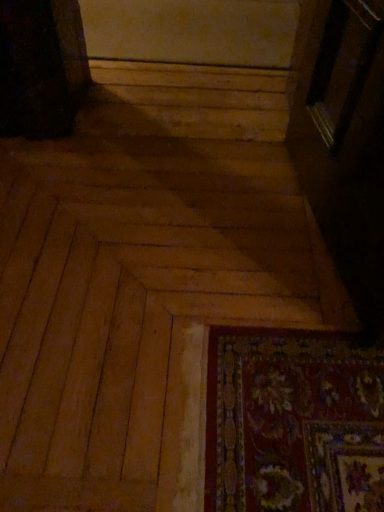
This screenshot has width=384, height=512. Find the location of `free space in front of wooden screen door at right`. free space in front of wooden screen door at right is located at coordinates (277, 369).